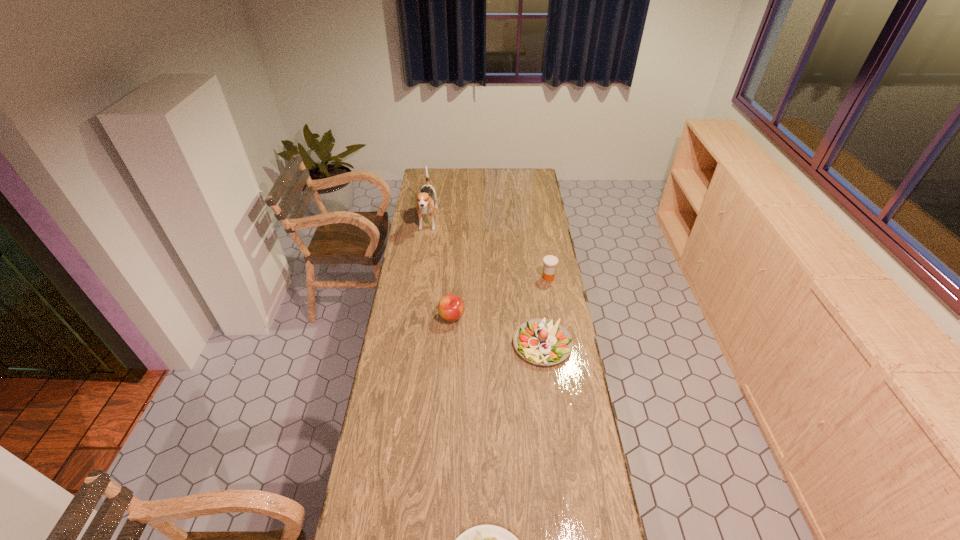
Identify the location of puppy. Image resolution: width=960 pixels, height=540 pixels. (424, 203).

The height and width of the screenshot is (540, 960). Find the location of `the leftmost object`. the leftmost object is located at coordinates (424, 203).

You are a GUI agent. You are given a task and a screenshot of the screen. Output one action in this format:
    pyautogui.click(x=<x>, y=<y>)
    Task: Click on the second farthest object
    
    Given the screenshot: What is the action you would take?
    pyautogui.click(x=550, y=262)

Find the location of a particular element. apple is located at coordinates (451, 307).

Locate an element on the screen. This screenshot has width=960, height=540. the second shortest object is located at coordinates (541, 341).

This screenshot has height=540, width=960. What are the coordinates of `the farther salad plate` in the screenshot? It's located at [x=541, y=341].

Find the location of `vacant position located at the face of the farthest object`. vacant position located at the face of the farthest object is located at coordinates (420, 272).

Locate an element on the screen. The width and height of the screenshot is (960, 540). free space located 0.210m on the label of the medicine is located at coordinates (497, 278).

Locate an element on the screen. Image resolution: width=960 pixels, height=540 pixels. free region located on the label of the medicine is located at coordinates (495, 278).

At what (x,y) coordinates should I click in order to perform the action: click on vacant space located 0.050m on the label of the medicine. Please return your answer as a coordinate pair (x, y). Looking at the image, I should click on (531, 278).